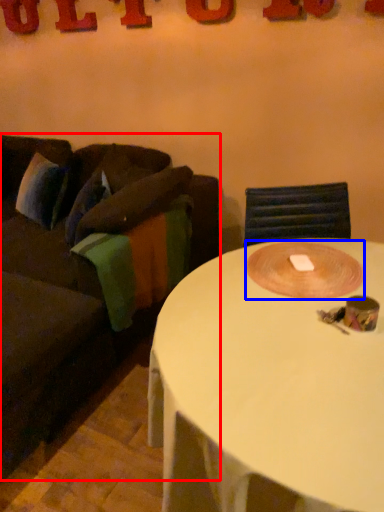
Question: Among these objects, which one is farthest to the camera, studio couch (highlighted by a red box) or oval (highlighted by a blue box)?

Choices:
 (A) studio couch
 (B) oval

Answer: (B)